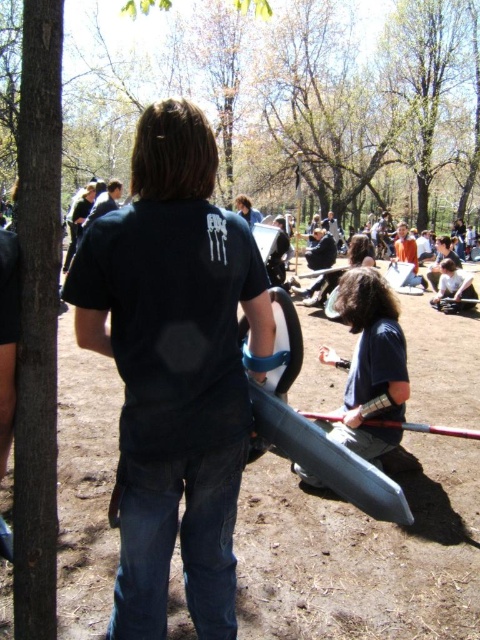
Does black matte shirt at center appear on the right side of matte black shirt at center?

No, black matte shirt at center is not to the right of matte black shirt at center.

Does black matte shirt at center have a greater height compared to matte black shirt at center?

Yes.

This screenshot has height=640, width=480. Identify the location of black matte shirt at center. (175, 369).

The image size is (480, 640). What are the coordinates of `black matte shirt at center` in the screenshot? It's located at (175, 369).

Is black matte shirt at center thinner than green leafy tree at upper center?

Yes.

Who is higher up, black matte shirt at center or green leafy tree at upper center?

green leafy tree at upper center is above.

The width and height of the screenshot is (480, 640). What do you see at coordinates (175, 369) in the screenshot?
I see `black matte shirt at center` at bounding box center [175, 369].

Where is `black matte shirt at center`? The width and height of the screenshot is (480, 640). black matte shirt at center is located at coordinates (175, 369).

Is brown dirt field at center positioned behind matte black shirt at center?

No.

Can you confirm if brown dirt field at center is positioned to the left of matte black shirt at center?

Indeed, brown dirt field at center is positioned on the left side of matte black shirt at center.

Locate an element on the screen. The image size is (480, 640). brown dirt field at center is located at coordinates (362, 554).